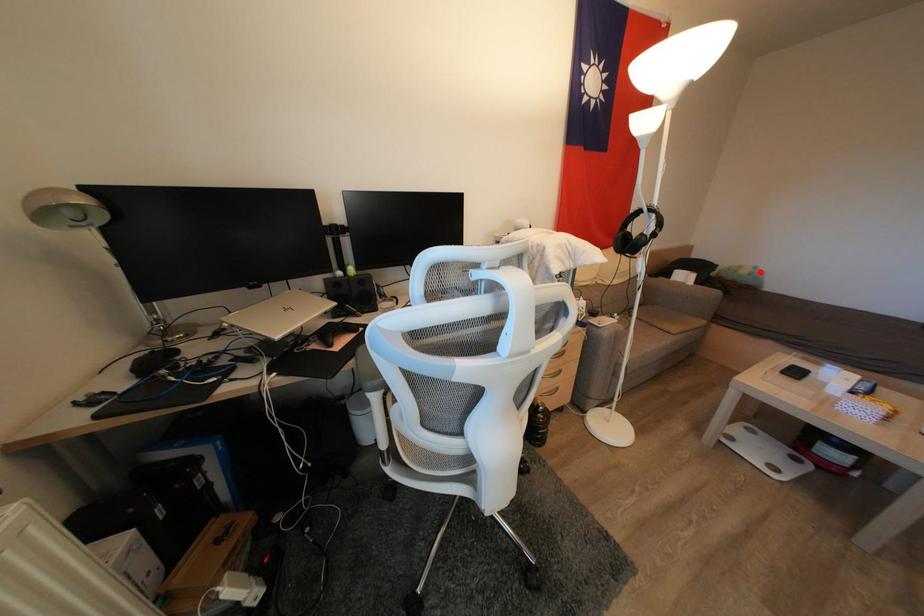
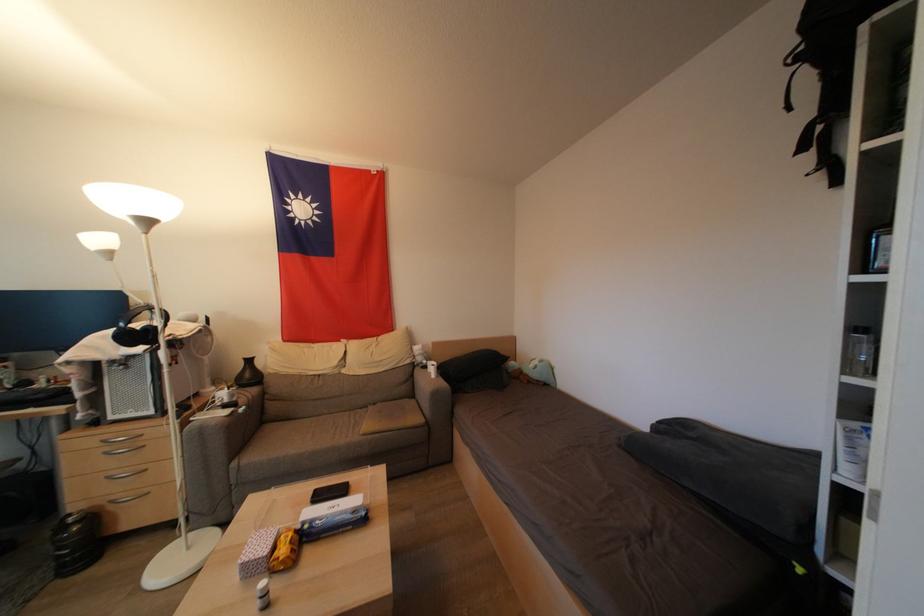
The point at the highlighted location is marked in the first image. Where is the corresponding point in the second image?

(545, 365)